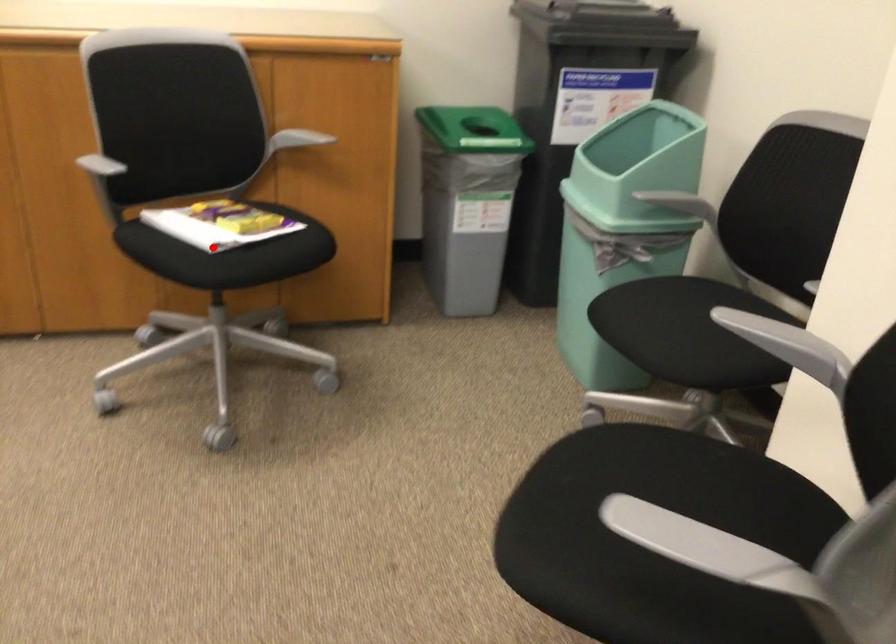
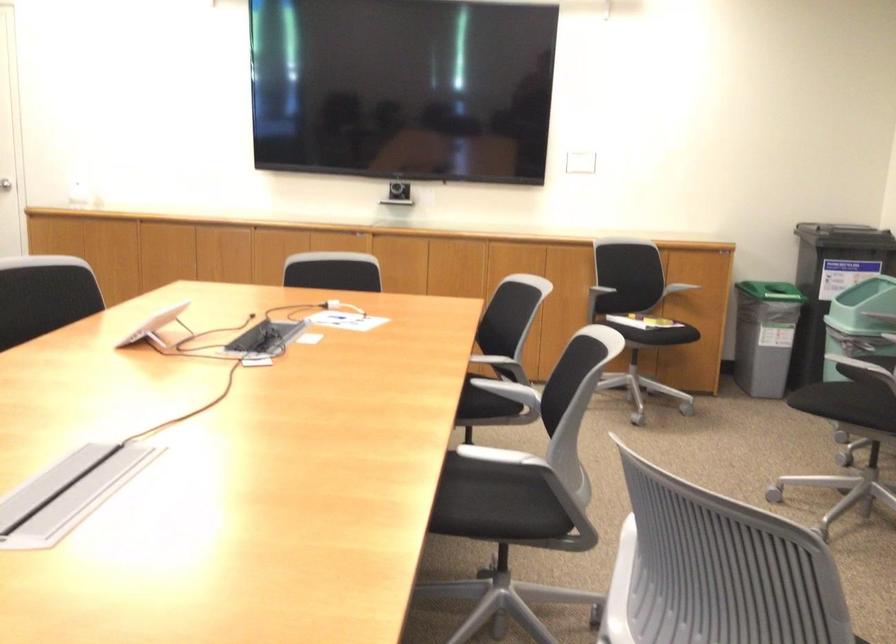
Find the pixel in the second image that matches the highlighted location in the first image.

(636, 313)